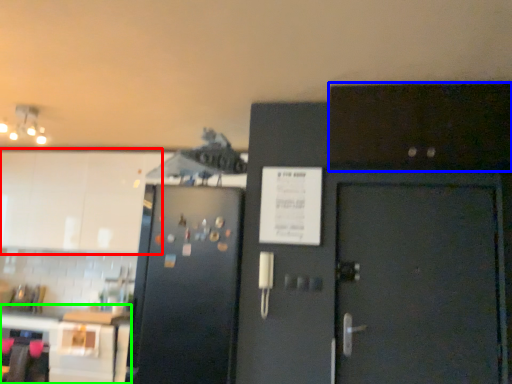
Question: Which is farther away from cabinetry (highlighted by a red box)? cabinetry (highlighted by a blue box) or table (highlighted by a green box)?

Choices:
 (A) cabinetry
 (B) table

Answer: (A)